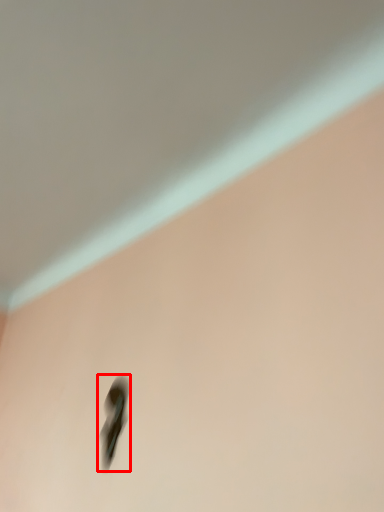
Question: In this image, where is footwear (annotated by the red box) located relative to backdrop?

Choices:
 (A) right
 (B) left

Answer: (A)